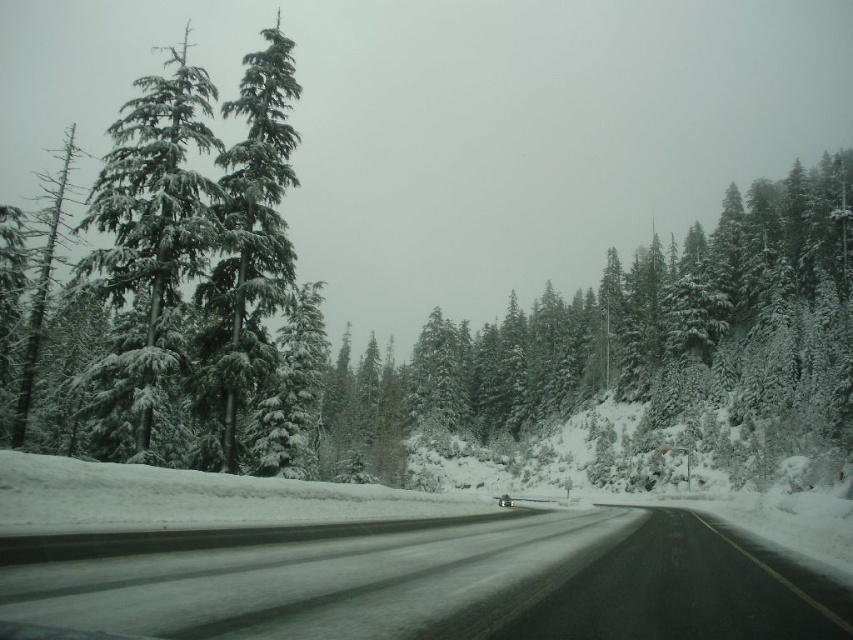
Who is more distant from viewer, (396, 444) or (122, 352)?

Point (396, 444)

Is snow-covered evergreen trees at center taller than snow-covered evergreen at left?

In fact, snow-covered evergreen trees at center may be shorter than snow-covered evergreen at left.

What are the coordinates of `snow-covered evergreen trees at center` in the screenshot? It's located at (642, 337).

Does snow-covered evergreen trees at left appear on the left side of snow-covered evergreen at left?

Incorrect, snow-covered evergreen trees at left is not on the left side of snow-covered evergreen at left.

Between snow-covered evergreen trees at left and snow-covered evergreen at left, which one is positioned higher?

snow-covered evergreen at left is above.

Does point (85, 385) come behind point (114, 243)?

No, it is in front of (114, 243).

Identify the location of snow-covered evergreen trees at left. (189, 259).

Does black asphalt road at center have a greater height compared to snow-covered evergreen trees at center?

Incorrect, black asphalt road at center's height is not larger of snow-covered evergreen trees at center's.

Can you confirm if black asphalt road at center is smaller than snow-covered evergreen trees at center?

Yes, black asphalt road at center is smaller than snow-covered evergreen trees at center.

Is point (438, 572) behind point (601, 301)?

No, (438, 572) is in front of (601, 301).

In order to click on black asphalt road at center in this screenshot , I will do `click(421, 580)`.